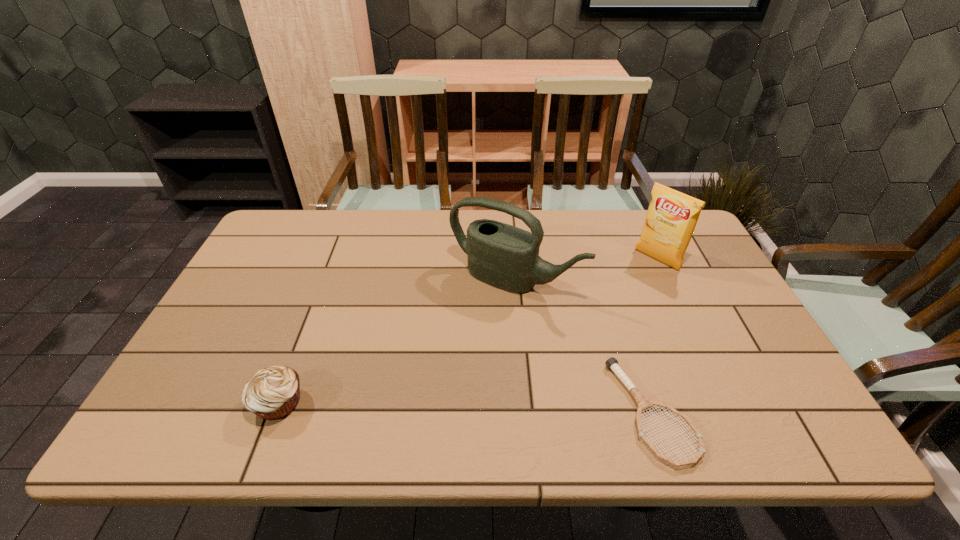
Locate an element on the screen. The image size is (960, 540). free spot at the near edge of the desktop is located at coordinates (581, 395).

In the image, there is a desktop. What are the coordinates of `vacant space at the left edge` in the screenshot? It's located at (242, 321).

In the image, there is a desktop. Where is `free space at the right edge`? The image size is (960, 540). free space at the right edge is located at coordinates (752, 351).

The image size is (960, 540). I want to click on free space at the far left corner of the desktop, so click(x=302, y=224).

In the image, there is a desktop. Identify the location of free space at the near left corner. This screenshot has height=540, width=960. (228, 402).

The width and height of the screenshot is (960, 540). In the image, there is a desktop. Find the location of `blank space at the near right corner`. blank space at the near right corner is located at coordinates (739, 384).

This screenshot has width=960, height=540. Find the location of `free space between the shortest object and the third tallest object`. free space between the shortest object and the third tallest object is located at coordinates (466, 407).

You are a GUI agent. You are given a task and a screenshot of the screen. Output one action in this format:
    pyautogui.click(x=<x>, y=<y>)
    Task: Click on the empty space that is in between the rightmost object and the second shortest object
    The width and height of the screenshot is (960, 540).
    Given the screenshot: What is the action you would take?
    pyautogui.click(x=468, y=331)

Identify the location of blank region between the rightmost object and the muffin. The width and height of the screenshot is (960, 540). (468, 331).

This screenshot has width=960, height=540. I want to click on unoccupied position between the second object from left to right and the crisp (potato chip), so click(586, 270).